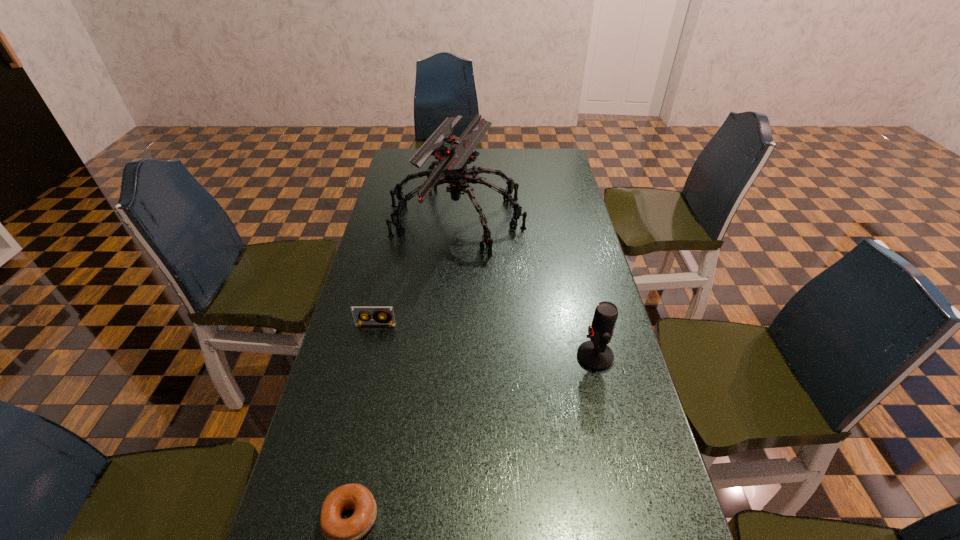
Locate an element on the screen. This screenshot has width=960, height=540. drone is located at coordinates (453, 155).

What are the coordinates of `the farthest object` in the screenshot? It's located at (453, 155).

This screenshot has height=540, width=960. Identify the location of the second nearest object. (594, 354).

Identify the location of microphone. (594, 354).

Find the location of a particular element. videotape is located at coordinates (358, 312).

You are a GUI agent. You are given a task and a screenshot of the screen. Output one action in this format:
    pyautogui.click(x=<x>, y=<y>)
    Task: Click on the second shortest object
    The height and width of the screenshot is (540, 960).
    Given the screenshot: What is the action you would take?
    pyautogui.click(x=358, y=312)

Where is `free space located on the right of the farthest object`? The width and height of the screenshot is (960, 540). free space located on the right of the farthest object is located at coordinates (553, 217).

Locate an element on the screen. This screenshot has height=540, width=960. vacant space located on the side of the third farthest object with the red ring is located at coordinates (484, 356).

Where is `free location located 0.190m on the side of the third farthest object with the red ring`? Image resolution: width=960 pixels, height=540 pixels. free location located 0.190m on the side of the third farthest object with the red ring is located at coordinates (503, 356).

Locate an element on the screen. The height and width of the screenshot is (540, 960). vacant space located 0.160m on the side of the third farthest object with the red ring is located at coordinates (515, 356).